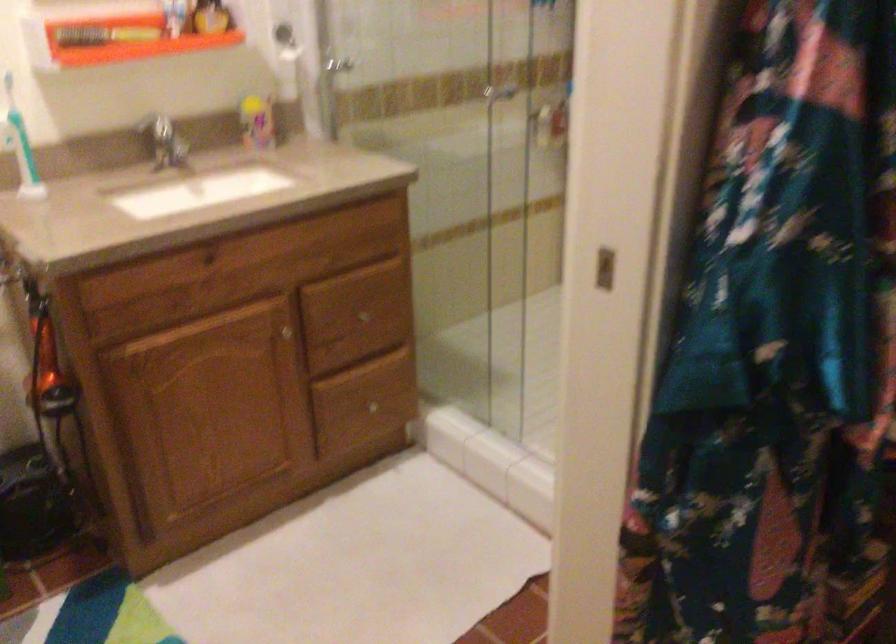
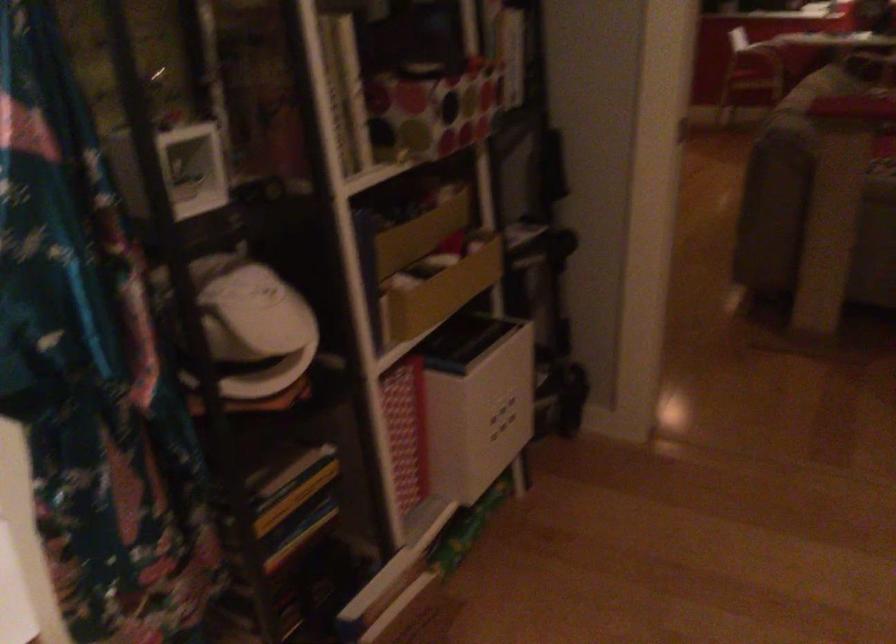
Question: The camera is either moving clockwise (left) or counter-clockwise (right) around the object. The first image is from the beginning of the video and the second image is from the end. Is the camera moving left or right when shooting the video?

Choices:
 (A) Left
 (B) Right

Answer: (A)